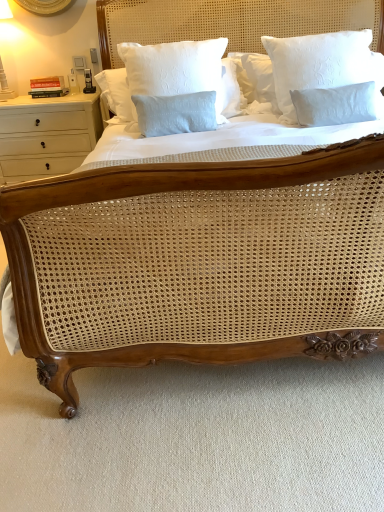
Question: Considering the positions of light blue cotton pillow at center, the 1th pillow positioned from the left, and white wood drawer at left in the image, is light blue cotton pillow at center, the 1th pillow positioned from the left, taller or shorter than white wood drawer at left?

Choices:
 (A) tall
 (B) short

Answer: (B)

Question: Is light blue cotton pillow at center, which appears as the second pillow when viewed from the right, in front of or behind white wood drawer at left in the image?

Choices:
 (A) behind
 (B) front

Answer: (B)

Question: Which object is the farthest from the white wood drawer at left?

Choices:
 (A) light blue cotton pillow at center, the 1th pillow positioned from the left
 (B) white textured pillow at upper right, which is counted as the 2th pillow, starting from the left

Answer: (B)

Question: Based on their relative distances, which object is farther from the light blue cotton pillow at center, which appears as the second pillow when viewed from the right?

Choices:
 (A) white textured pillow at upper right, which is counted as the 2th pillow, starting from the left
 (B) white wood drawer at left

Answer: (B)